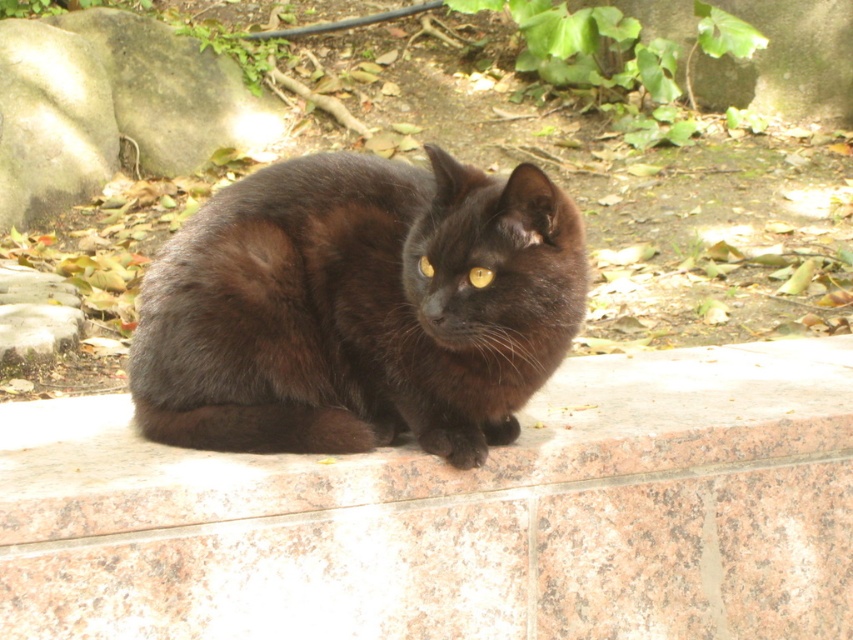
Question: Which object is positioned farthest from the shiny black cat at center?

Choices:
 (A) pink granite ledge at center
 (B) gray rough rock at upper left
 (C) golden shiny eye at center
 (D) green leafy plant at upper center

Answer: (D)

Question: Which point appears closest to the camera in this image?

Choices:
 (A) (421, 438)
 (B) (827, 88)
 (C) (428, 272)

Answer: (C)

Question: Is pink granite ledge at center in front of gray rough rock at upper left?

Choices:
 (A) yes
 (B) no

Answer: (A)

Question: Among these points, which one is farthest from the camera?

Choices:
 (A) (363, 266)
 (B) (802, 13)
 (C) (422, 256)
 (D) (111, 156)

Answer: (B)

Question: Observing the image, what is the correct spatial positioning of pink granite ledge at center in reference to gray rough rock at upper left?

Choices:
 (A) below
 (B) above

Answer: (A)

Question: Does gray rough rock at upper left have a smaller size compared to yellow shiny eye at center?

Choices:
 (A) no
 (B) yes

Answer: (A)